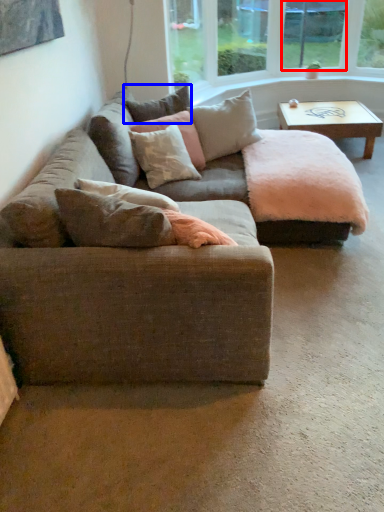
Question: Which object is further to the camera taking this photo, window screen (highlighted by a red box) or pillow (highlighted by a blue box)?

Choices:
 (A) window screen
 (B) pillow

Answer: (A)